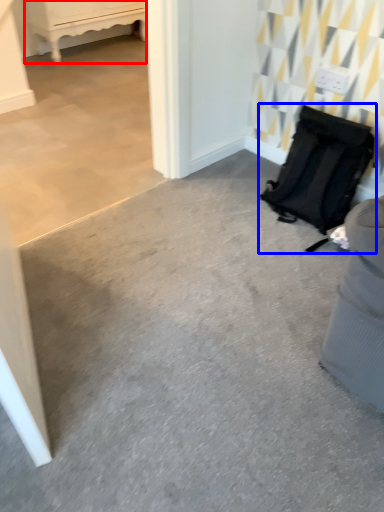
Question: Among these objects, which one is farthest to the camera, furniture (highlighted by a red box) or luggage and bags (highlighted by a blue box)?

Choices:
 (A) furniture
 (B) luggage and bags

Answer: (A)